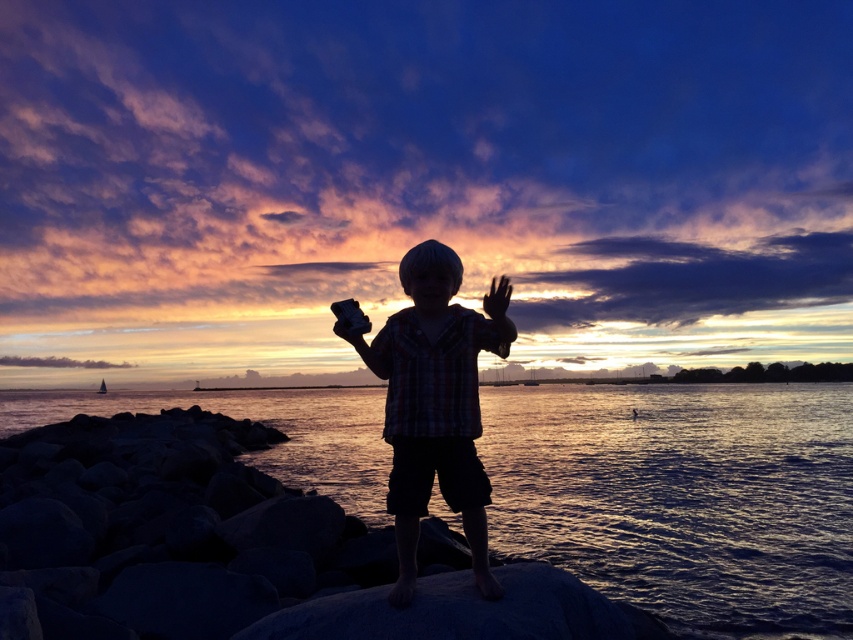
You are a photographer trying to capture the sunset scene. The plaid shirt at center and silky skin hand at center are in your frame. Which object would you focus on if you want to highlight the larger one?

The plaid shirt at center is larger in size than the silky skin hand at center, so focusing on the plaid shirt at center would highlight the larger object.

A child is standing on a rocky outcrop at the point (788, 448). If the child wants to throw a stone to reach the water, which is 23.09 meters away, what is the minimum distance the child needs to throw the stone to reach the water?

The minimum distance the child needs to throw the stone to reach the water is 23.09 meters, as that is the distance between the child and the water.

You are a photographer trying to capture the sunset. You notice the glistening water at center and the black matte hand at center in your frame. Which object occupies more horizontal space in the image?

The glistening water at center has a greater width than the black matte hand at center, so it occupies more horizontal space in the image.